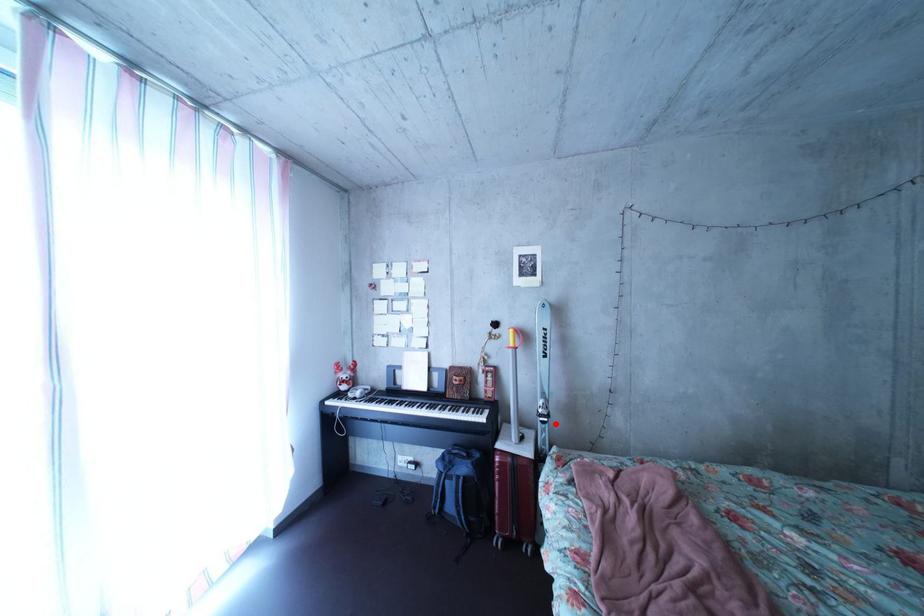
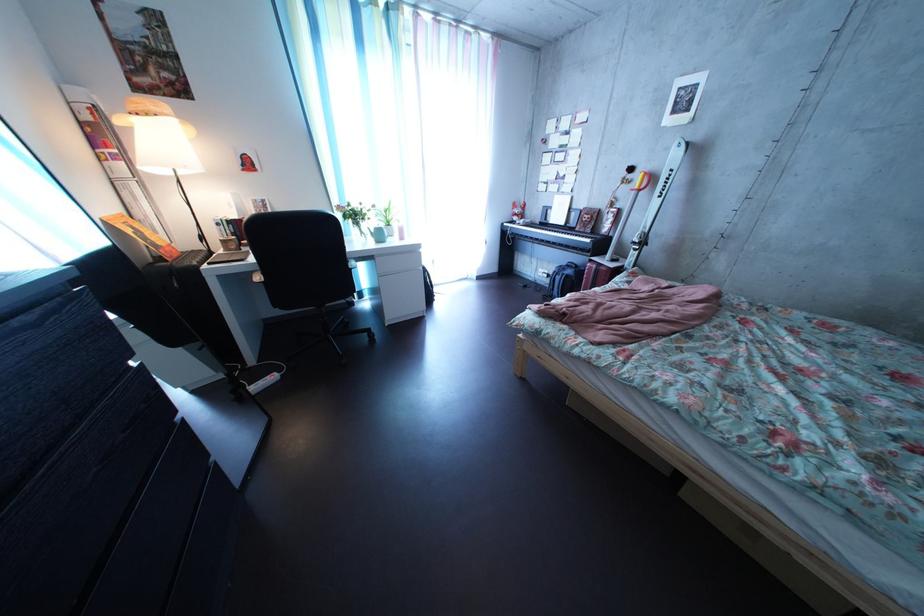
Where in the second image is the point corresponding to the highlighted location from the first image?

(648, 252)